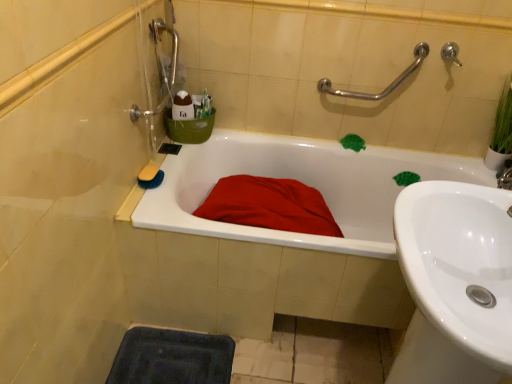
Locate an element on the screen. blank area beneath silver metallic grab bar at upper right (from a real-world perspective) is located at coordinates (355, 144).